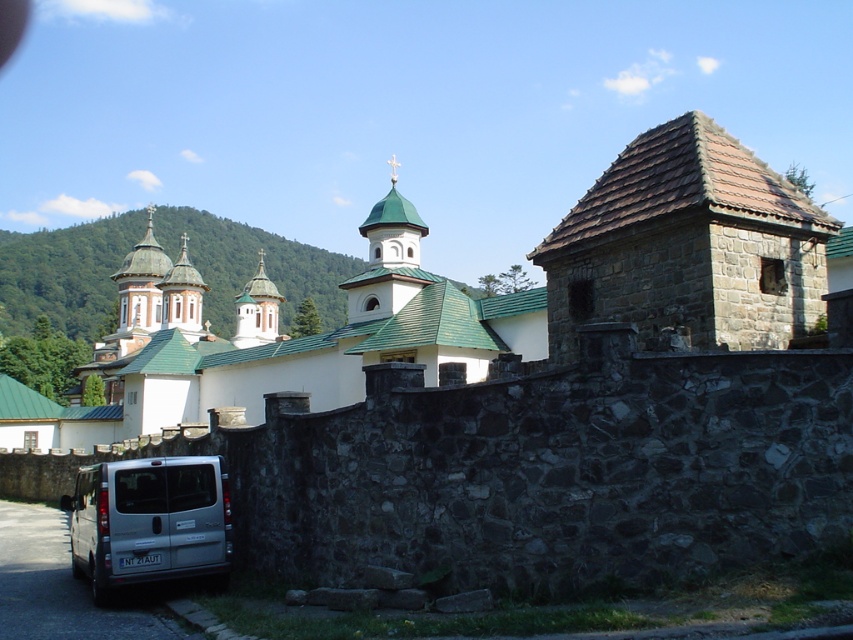
You are standing at the center of the monastery courtyard. There is a silver metallic van at lower left marked by point (149, 522). If you want to reach the van, should you walk towards the wall or away from it?

The point (149, 522) marks the silver metallic van at lower left. Since the van is parked along the side of the stone wall in the foreground, you should walk towards the wall to reach it.

You are planning to take a photo of the white stone church at center. However, the silver metallic van at lower left is blocking part of the view. Can you estimate whether the church is wider than the van to determine if moving the van would fully reveal the church?

The white stone church at center might be wider than silver metallic van at lower left, so moving the van could potentially reveal the entire church if the church is indeed wider.